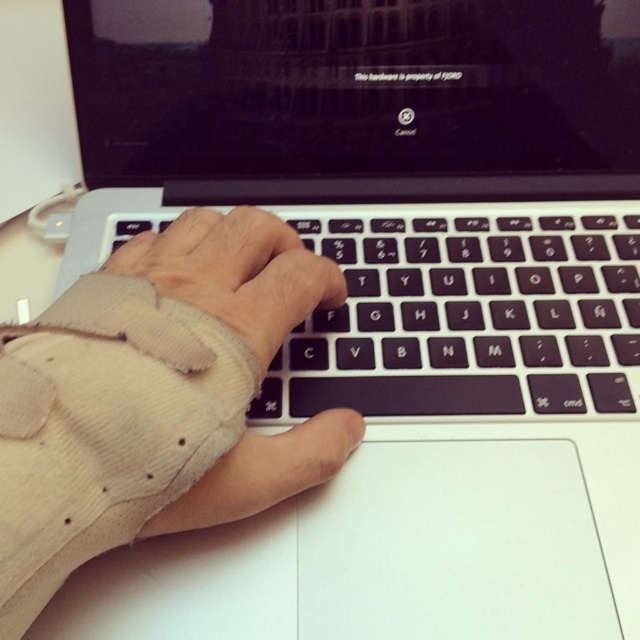
Question: In this image, where is beige corduroy sleeve at center located relative to black matte keyboard at center?

Choices:
 (A) left
 (B) right

Answer: (A)

Question: Is beige corduroy sleeve at center closer to camera compared to black matte keyboard at center?

Choices:
 (A) yes
 (B) no

Answer: (A)

Question: Which object is farther from the camera taking this photo?

Choices:
 (A) beige corduroy sleeve at center
 (B) black matte keyboard at center

Answer: (B)

Question: Does beige corduroy sleeve at center have a lesser width compared to black matte keyboard at center?

Choices:
 (A) no
 (B) yes

Answer: (B)